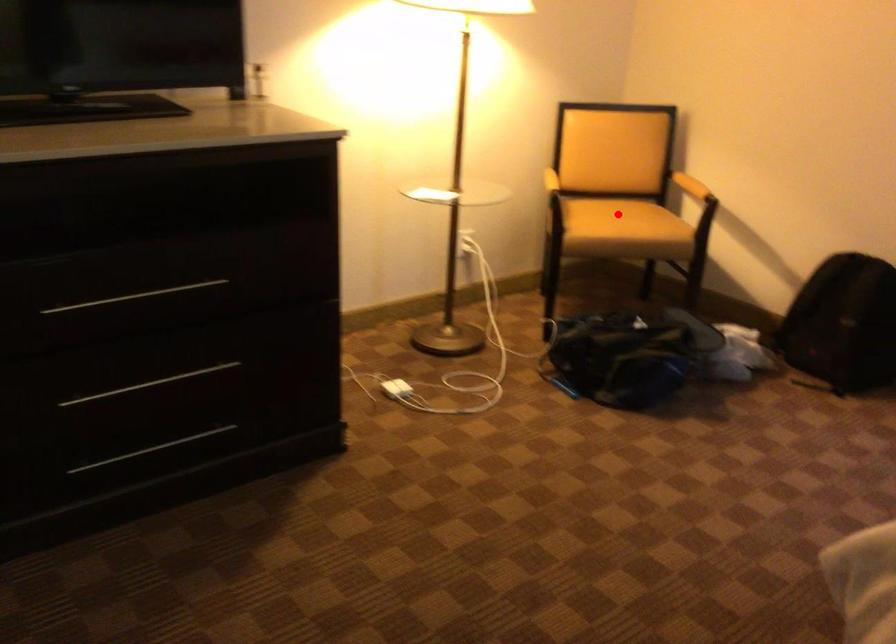
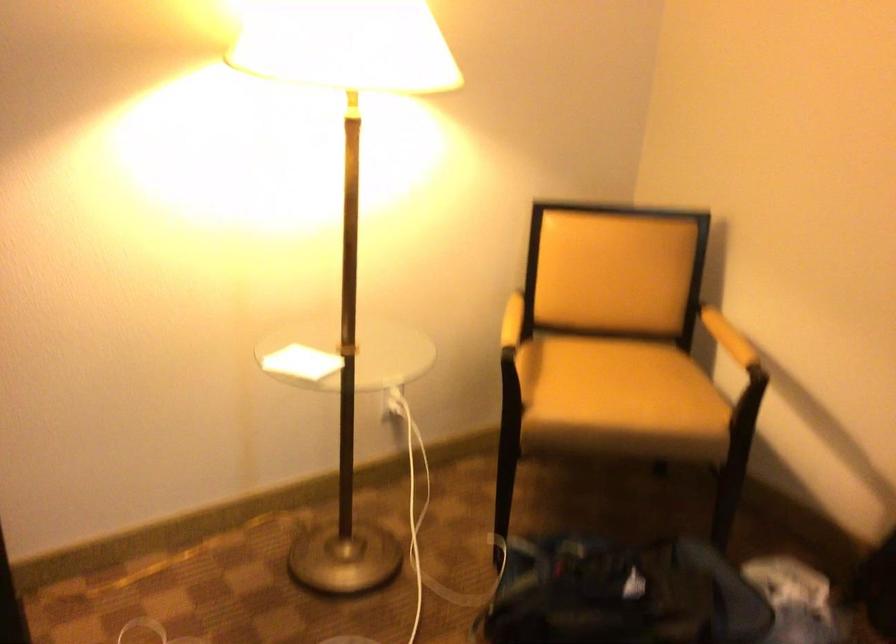
Locate, in the second image, the point that corresponds to the highlighted location in the first image.

(618, 388)